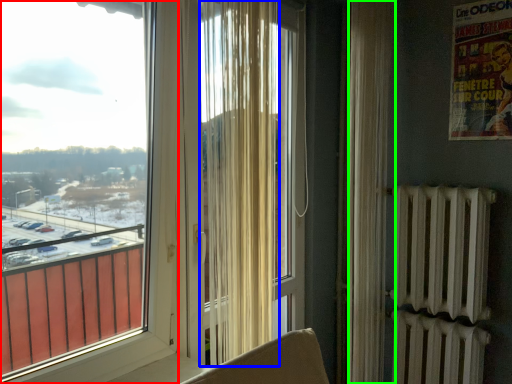
Question: Which object is the farthest from window (highlighted by a red box)? Choose among these: curtain (highlighted by a blue box) or curtain (highlighted by a green box).

Choices:
 (A) curtain
 (B) curtain

Answer: (B)